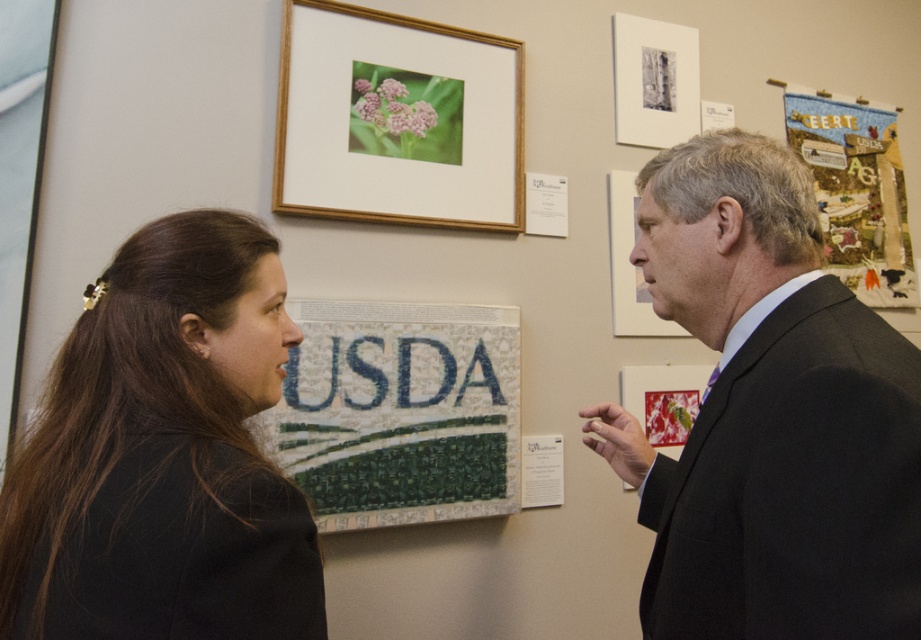
What is the object located at point (857, 193) in the image?

The object at point (857, 193) is a textured fabric poster at upper right.

You are an art installer in a gallery. You need to hang a new small decorative item between the textured fabric poster at upper right and the matte wood picture frame at upper right. Which object should you place the new item closer to to ensure it fits properly?

The textured fabric poster at upper right is bigger than the matte wood picture frame at upper right. To ensure the new item fits properly, place it closer to the matte wood picture frame at upper right since it is smaller and requires less space.